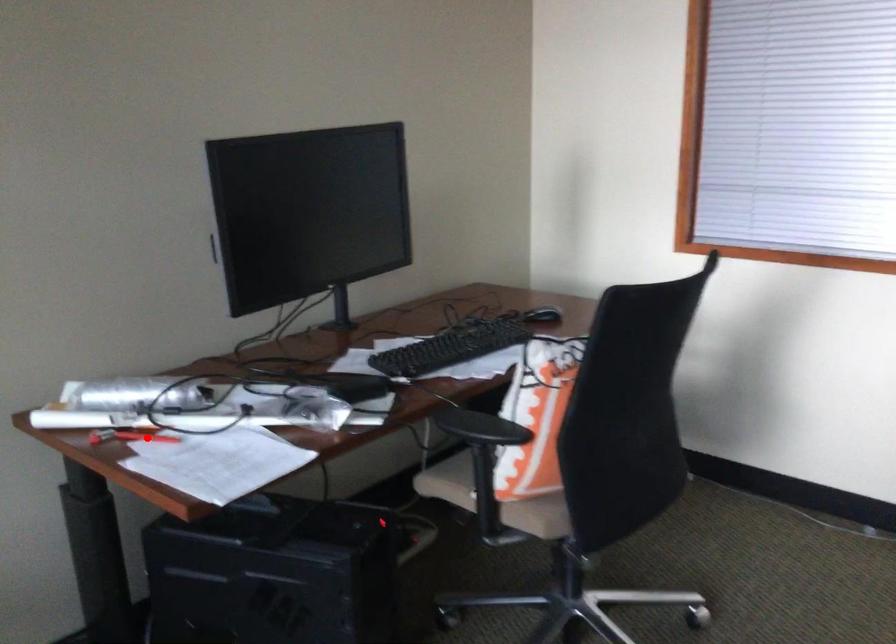
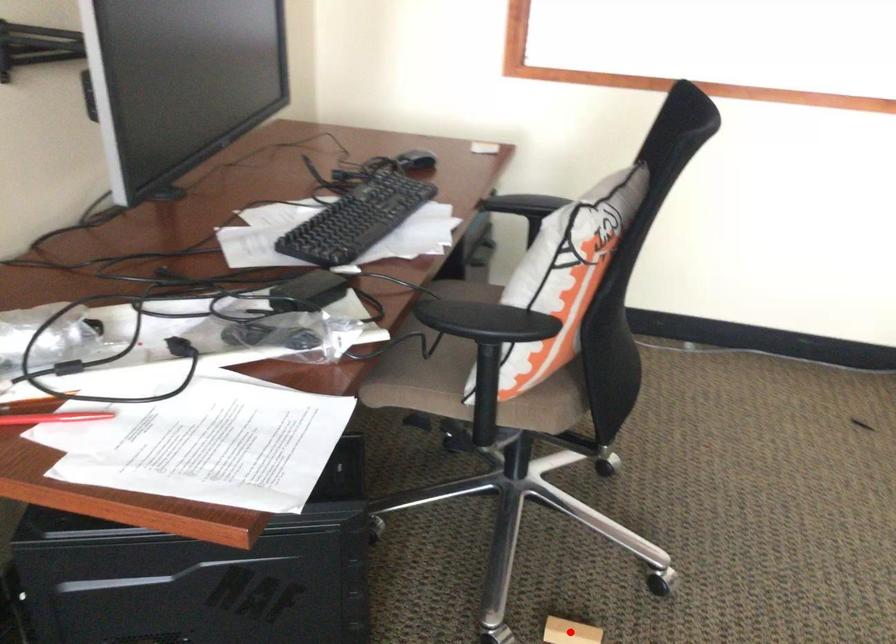
I am providing you with two images of the same scene from different viewpoints. A red point is marked on the first image and another point is marked on the second image. Does the point marked in image1 correspond to the same location as the one in image2?

No